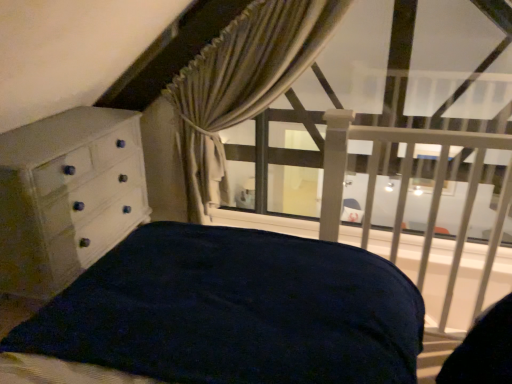
You are a GUI agent. You are given a task and a screenshot of the screen. Output one action in this format:
    pyautogui.click(x=<x>, y=<y>)
    Task: Click on the beige textured curtain at upper center
    The image size is (512, 384).
    Given the screenshot: What is the action you would take?
    pyautogui.click(x=242, y=84)

How different are the orientations of beige textured curtain at upper center and white painted wood chest of drawers at left in degrees?

The facing directions of beige textured curtain at upper center and white painted wood chest of drawers at left are 97.1 degrees apart.

Does point (270, 2) appear closer or farther from the camera than point (9, 151)?

Point (270, 2) is positioned farther from the camera compared to point (9, 151).

Does beige textured curtain at upper center appear on the left side of white painted wood chest of drawers at left?

No, beige textured curtain at upper center is not to the left of white painted wood chest of drawers at left.

Considering the relative sizes of white painted wood chest of drawers at left and beige textured curtain at upper center in the image provided, is white painted wood chest of drawers at left bigger than beige textured curtain at upper center?

Yes, white painted wood chest of drawers at left is bigger than beige textured curtain at upper center.

Does white painted wood chest of drawers at left have a greater height compared to beige textured curtain at upper center?

Incorrect, the height of white painted wood chest of drawers at left is not larger of that of beige textured curtain at upper center.

Would you say beige textured curtain at upper center is part of white painted wood chest of drawers at left's contents?

No, beige textured curtain at upper center is not inside white painted wood chest of drawers at left.

Considering the sizes of objects white painted wood chest of drawers at left and beige textured curtain at upper center in the image provided, who is thinner, white painted wood chest of drawers at left or beige textured curtain at upper center?

beige textured curtain at upper center.

Who is shorter, white matte balustrade at upper right or white painted wood chest of drawers at left?

white painted wood chest of drawers at left is shorter.

Is white painted wood chest of drawers at left located within white matte balustrade at upper right?

No, white painted wood chest of drawers at left is not a part of white matte balustrade at upper right.

From the image's perspective, is white matte balustrade at upper right on white painted wood chest of drawers at left?

Incorrect, from the image's perspective, white matte balustrade at upper right is lower than white painted wood chest of drawers at left.

Is white matte balustrade at upper right taller or shorter than beige textured curtain at upper center?

white matte balustrade at upper right is shorter than beige textured curtain at upper center.

Does point (509, 188) come in front of point (338, 21)?

Yes, it is.

Is white matte balustrade at upper right not inside beige textured curtain at upper center?

Yes, white matte balustrade at upper right is located beyond the bounds of beige textured curtain at upper center.

Considering the relative positions of white matte balustrade at upper right and beige textured curtain at upper center in the image provided, is white matte balustrade at upper right in front of beige textured curtain at upper center?

That is True.

Considering the relative sizes of beige textured curtain at upper center and white matte balustrade at upper right in the image provided, is beige textured curtain at upper center shorter than white matte balustrade at upper right?

Incorrect, the height of beige textured curtain at upper center does not fall short of that of white matte balustrade at upper right.

From a real-world perspective, between beige textured curtain at upper center and white matte balustrade at upper right, who is vertically lower?

In real-world perspective, white matte balustrade at upper right is lower.

Is beige textured curtain at upper center facing towards white matte balustrade at upper right?

No, beige textured curtain at upper center does not turn towards white matte balustrade at upper right.

Is beige textured curtain at upper center thinner than white matte balustrade at upper right?

Indeed, beige textured curtain at upper center has a lesser width compared to white matte balustrade at upper right.

Is point (63, 213) behind point (458, 234)?

No.

Between white painted wood chest of drawers at left and white matte balustrade at upper right, which one has less height?

white painted wood chest of drawers at left is shorter.

Looking at this image, can we say white painted wood chest of drawers at left lies outside white matte balustrade at upper right?

Absolutely, white painted wood chest of drawers at left is external to white matte balustrade at upper right.

From the image's perspective, is white painted wood chest of drawers at left above white matte balustrade at upper right?

Indeed, from the image's perspective, white painted wood chest of drawers at left is shown above white matte balustrade at upper right.

What are the coordinates of `curtain on the right of white painted wood chest of drawers at left` in the screenshot? It's located at (242, 84).

At what (x,y) coordinates should I click in order to perform the action: click on the chest of drawers that appears below the beige textured curtain at upper center (from a real-world perspective). Please return your answer as a coordinate pair (x, y). The height and width of the screenshot is (384, 512). Looking at the image, I should click on (67, 196).

Estimate the real-world distances between objects in this image. Which object is closer to white matte balustrade at upper right, beige textured curtain at upper center or white painted wood chest of drawers at left?

beige textured curtain at upper center lies closer to white matte balustrade at upper right than the other object.

From the picture: Estimate the real-world distances between objects in this image. Which object is further from white painted wood chest of drawers at left, beige textured curtain at upper center or white matte balustrade at upper right?

white matte balustrade at upper right lies further to white painted wood chest of drawers at left than the other object.

Looking at the image, which one is located further to white matte balustrade at upper right, white painted wood chest of drawers at left or beige textured curtain at upper center?

The object further to white matte balustrade at upper right is white painted wood chest of drawers at left.

When comparing their distances from white painted wood chest of drawers at left, does white matte balustrade at upper right or beige textured curtain at upper center seem closer?

Based on the image, beige textured curtain at upper center appears to be nearer to white painted wood chest of drawers at left.

From the image, which object appears to be farther from beige textured curtain at upper center, white painted wood chest of drawers at left or white matte balustrade at upper right?

white matte balustrade at upper right lies further to beige textured curtain at upper center than the other object.

From the image, which object appears to be farther from beige textured curtain at upper center, white matte balustrade at upper right or white painted wood chest of drawers at left?

white matte balustrade at upper right is positioned further to the anchor beige textured curtain at upper center.

What are the coordinates of `curtain between white painted wood chest of drawers at left and white matte balustrade at upper right in the horizontal direction` in the screenshot? It's located at (242, 84).